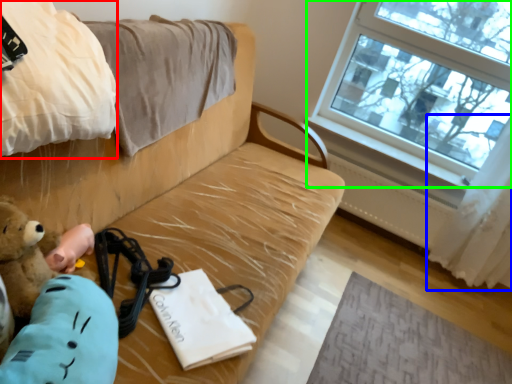
Question: Considering the real-world distances, which object is closest to blanket (highlighted by a red box)? curtain (highlighted by a blue box) or window (highlighted by a green box).

Choices:
 (A) curtain
 (B) window

Answer: (B)